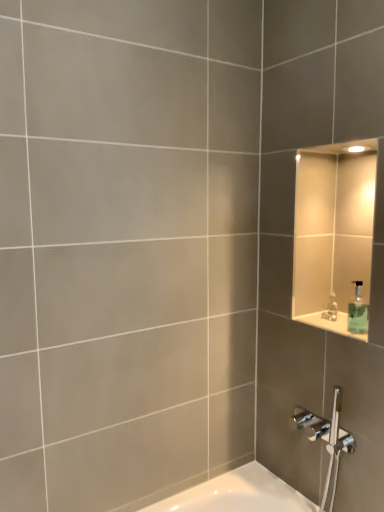
Question: Relative to silver metallic faucet at upper right, is green translucent soap dispenser at upper right in front or behind?

Choices:
 (A) front
 (B) behind

Answer: (A)

Question: Looking at their shapes, would you say green translucent soap dispenser at upper right is wider or thinner than silver metallic faucet at upper right?

Choices:
 (A) wide
 (B) thin

Answer: (A)

Question: In terms of height, does green translucent soap dispenser at upper right look taller or shorter compared to silver metallic faucet at upper right?

Choices:
 (A) tall
 (B) short

Answer: (A)

Question: Relative to green translucent soap dispenser at upper right, is silver metallic faucet at upper right in front or behind?

Choices:
 (A) front
 (B) behind

Answer: (B)

Question: From a real-world perspective, is silver metallic faucet at upper right positioned above or below green translucent soap dispenser at upper right?

Choices:
 (A) below
 (B) above

Answer: (A)

Question: Visually, is silver metallic faucet at upper right positioned to the left or to the right of green translucent soap dispenser at upper right?

Choices:
 (A) right
 (B) left

Answer: (B)

Question: Which is correct: silver metallic faucet at upper right is inside green translucent soap dispenser at upper right, or outside of it?

Choices:
 (A) outside
 (B) inside

Answer: (A)